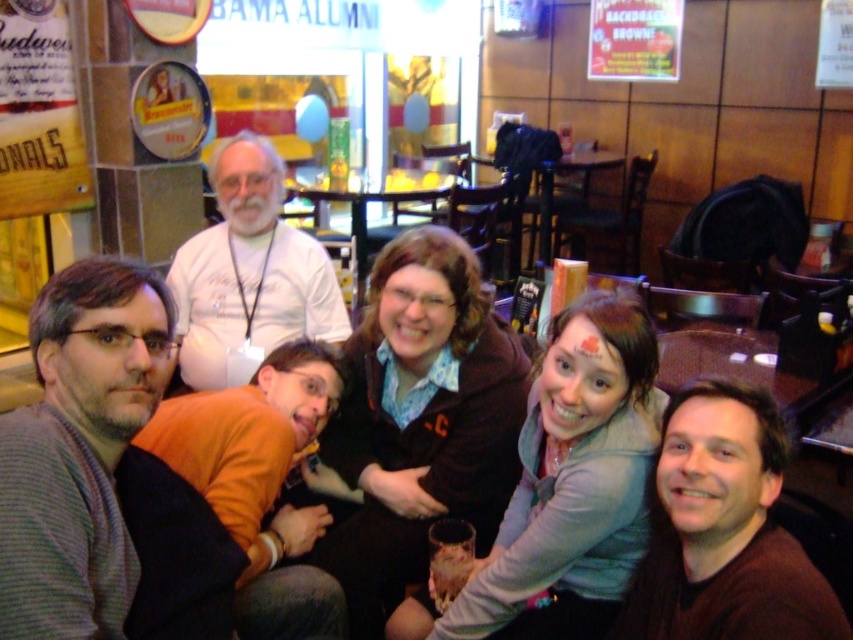
You are a photographer taking a group photo of the matte black jacket at center and the light gray sweater at center. Which one is positioned to the left?

The matte black jacket at center is positioned to the left of the light gray sweater at center.

You are a photographer taking a picture of the gray striped sweater at left and the orange fleece at lower left. Which one should you focus on first if you want to capture both in the same frame?

The gray striped sweater at left should be focused on first because it is positioned on the left side of the orange fleece at lower left, so adjusting focus from left to right would ensure both are captured.

You are a photographer taking a picture of the group at the dining establishment. You want to focus on the gray striped sweater at left. Where exactly should you point your camera to capture it?

You should point your camera at point (79, 449) to capture the gray striped sweater at left.